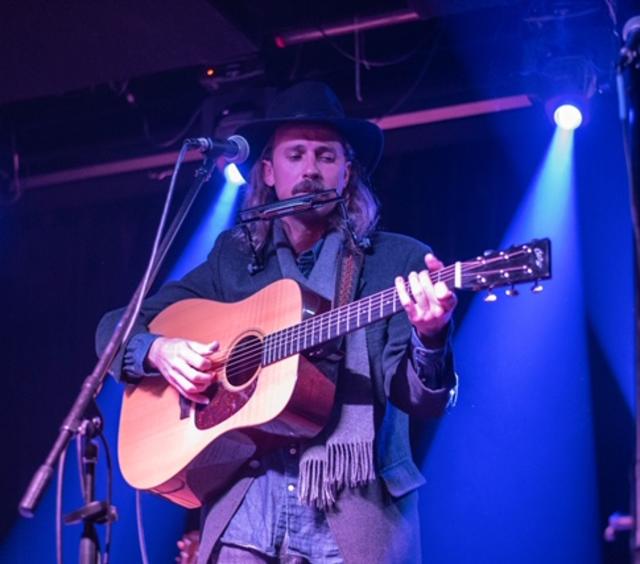
Where is `grey tassles`? Image resolution: width=640 pixels, height=564 pixels. grey tassles is located at coordinates 340,468.